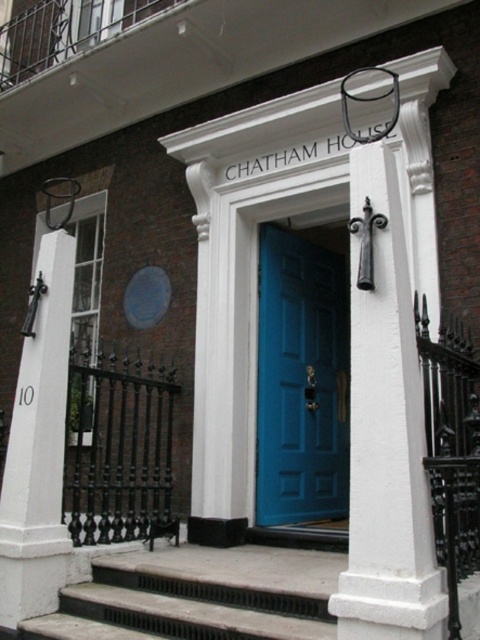
Question: Observing the image, what is the correct spatial positioning of teal glossy door at center in reference to white stone post at left?

Choices:
 (A) below
 (B) above

Answer: (B)

Question: Among these points, which one is nearest to the camera?

Choices:
 (A) (276, 429)
 (B) (372, 150)
 (C) (0, 605)

Answer: (B)

Question: Considering the relative positions of white painted wood at center and white stone post at left in the image provided, where is white painted wood at center located with respect to white stone post at left?

Choices:
 (A) below
 (B) above

Answer: (B)

Question: Which of the following is the farthest from the observer?

Choices:
 (A) (311, 296)
 (B) (59, 323)

Answer: (A)

Question: Which point is farther from the camera taking this photo?

Choices:
 (A) (282, 372)
 (B) (380, 356)
 (C) (44, 563)

Answer: (A)

Question: Does teal glossy door at center have a greater width compared to white stone post at left?

Choices:
 (A) yes
 (B) no

Answer: (A)